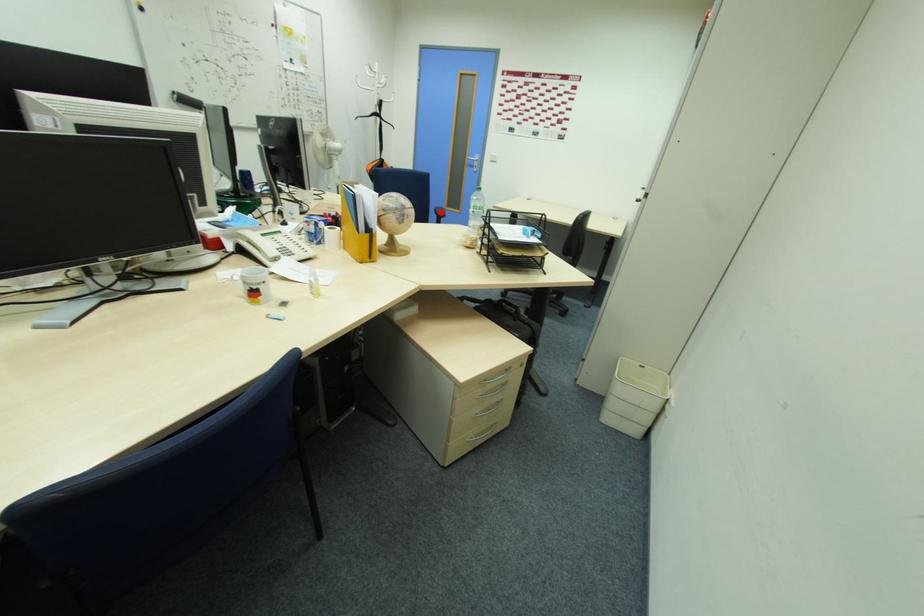
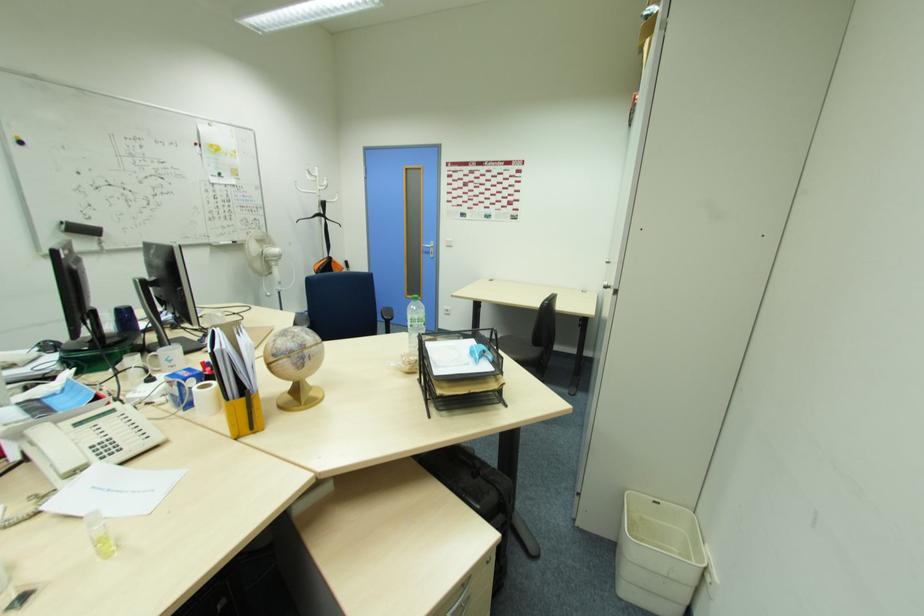
Question: I am providing you with two images of the same scene from different viewpoints. In image1, a red point is highlighted. Considering the same 3D point in image2, which of the following is correct?

Choices:
 (A) It is closer
 (B) It is farther

Answer: (B)